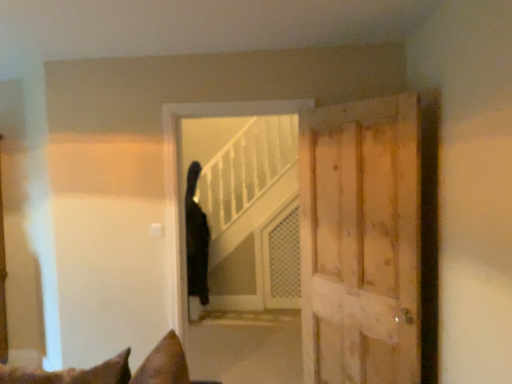
Question: Considering the relative sizes of light brown wooden door at right and white mesh screen door at center in the image provided, is light brown wooden door at right bigger than white mesh screen door at center?

Choices:
 (A) yes
 (B) no

Answer: (A)

Question: From the image's perspective, would you say light brown wooden door at right is shown under white mesh screen door at center?

Choices:
 (A) no
 (B) yes

Answer: (A)

Question: Is light brown wooden door at right wider than white mesh screen door at center?

Choices:
 (A) no
 (B) yes

Answer: (A)

Question: Is light brown wooden door at right in contact with white mesh screen door at center?

Choices:
 (A) yes
 (B) no

Answer: (B)

Question: Considering the relative sizes of light brown wooden door at right and white mesh screen door at center in the image provided, is light brown wooden door at right shorter than white mesh screen door at center?

Choices:
 (A) no
 (B) yes

Answer: (A)

Question: Considering the relative positions of black fur cat at center and light brown wooden door at right in the image provided, is black fur cat at center to the left or to the right of light brown wooden door at right?

Choices:
 (A) left
 (B) right

Answer: (A)

Question: Considering the positions of point (196, 167) and point (416, 352), is point (196, 167) closer or farther from the camera than point (416, 352)?

Choices:
 (A) closer
 (B) farther

Answer: (B)

Question: Looking at the image, does black fur cat at center seem bigger or smaller compared to light brown wooden door at right?

Choices:
 (A) small
 (B) big

Answer: (A)

Question: Relative to light brown wooden door at right, is black fur cat at center in front or behind?

Choices:
 (A) behind
 (B) front

Answer: (A)

Question: Does point (208, 274) appear closer or farther from the camera than point (267, 248)?

Choices:
 (A) farther
 (B) closer

Answer: (A)

Question: From the image's perspective, relative to white mesh screen door at center, is black matte elevator at center above or below?

Choices:
 (A) below
 (B) above

Answer: (B)

Question: Is black matte elevator at center in front of or behind white mesh screen door at center in the image?

Choices:
 (A) front
 (B) behind

Answer: (A)

Question: Do you think black matte elevator at center is within white mesh screen door at center, or outside of it?

Choices:
 (A) outside
 (B) inside

Answer: (A)

Question: Is point (292, 230) closer or farther from the camera than point (368, 190)?

Choices:
 (A) closer
 (B) farther

Answer: (B)

Question: Considering their positions, is white mesh screen door at center located in front of or behind light brown wooden door at right?

Choices:
 (A) behind
 (B) front

Answer: (A)